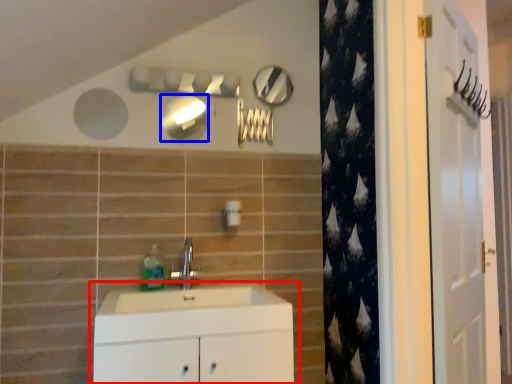
Question: Which of the following is the farthest to the observer, bathroom cabinet (highlighted by a red box) or mirror (highlighted by a blue box)?

Choices:
 (A) bathroom cabinet
 (B) mirror

Answer: (B)